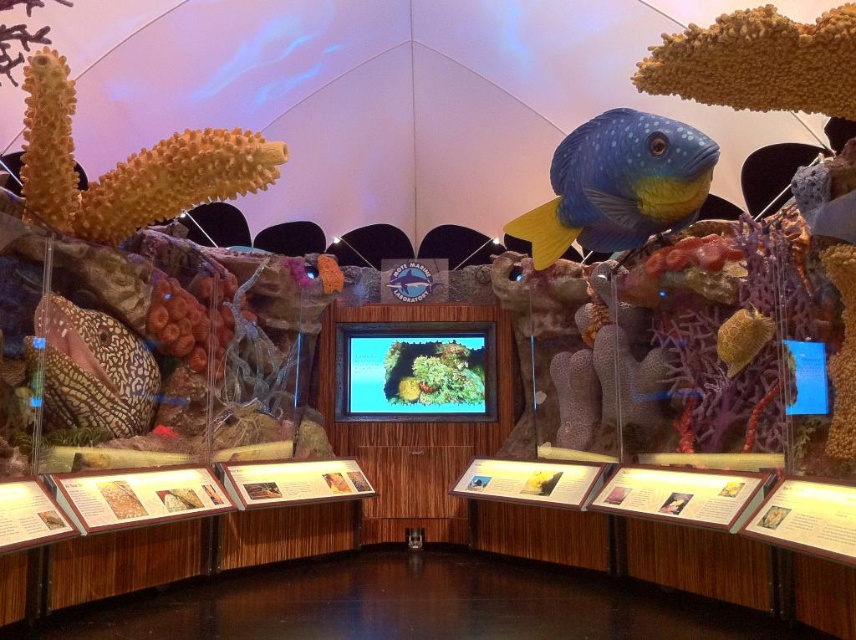
You are a visitor standing in the exhibit and want to take a photo of the speckled gold fish at left without the blue matte fish at center blocking it. How should you position yourself?

Move to the side of the exhibit so that the blue matte fish at center is no longer between you and the speckled gold fish at left.

You are a visitor standing at the entrance of the exhibit. You want to take a photo of the blue matte fish at center without any obstruction. Is there enough space between you and the fish to do so?

The distance between you and the blue matte fish at center is 14.31 feet, which should provide sufficient space to take an unobstructed photo.